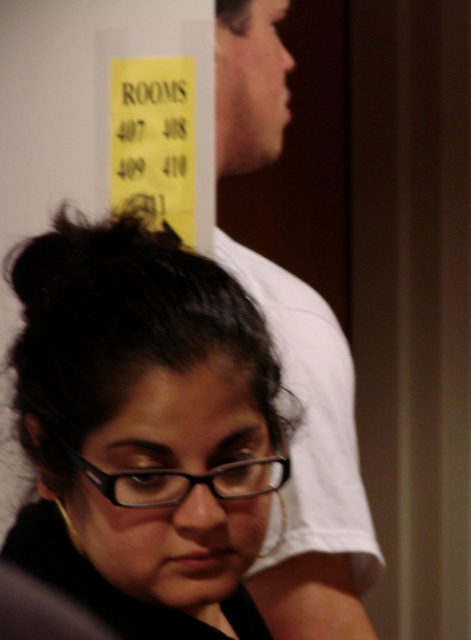
Is black matte hair at center below black plastic glasses at lower center?

No, black matte hair at center is not below black plastic glasses at lower center.

Is black matte hair at center closer to the viewer compared to black plastic glasses at lower center?

That is True.

Image resolution: width=471 pixels, height=640 pixels. I want to click on black matte hair at center, so click(x=144, y=429).

Can you confirm if white cotton shirt at upper right is bigger than black plastic glasses at lower center?

Yes, white cotton shirt at upper right is bigger than black plastic glasses at lower center.

Is white cotton shirt at upper right to the left of black plastic glasses at lower center from the viewer's perspective?

No, white cotton shirt at upper right is not to the left of black plastic glasses at lower center.

Describe the element at coordinates (311, 465) in the screenshot. Image resolution: width=471 pixels, height=640 pixels. I see `white cotton shirt at upper right` at that location.

I want to click on white cotton shirt at upper right, so click(x=311, y=465).

Between point (132, 269) and point (349, 456), which one is positioned in front?

Point (132, 269) is more forward.

Between black matte hair at center and white cotton shirt at upper right, which one appears on the right side from the viewer's perspective?

From the viewer's perspective, white cotton shirt at upper right appears more on the right side.

At what (x,y) coordinates should I click in order to perform the action: click on black matte hair at center. Please return your answer as a coordinate pair (x, y). Looking at the image, I should click on (144, 429).

Locate an element on the screen. The height and width of the screenshot is (640, 471). black matte hair at center is located at coordinates (144, 429).